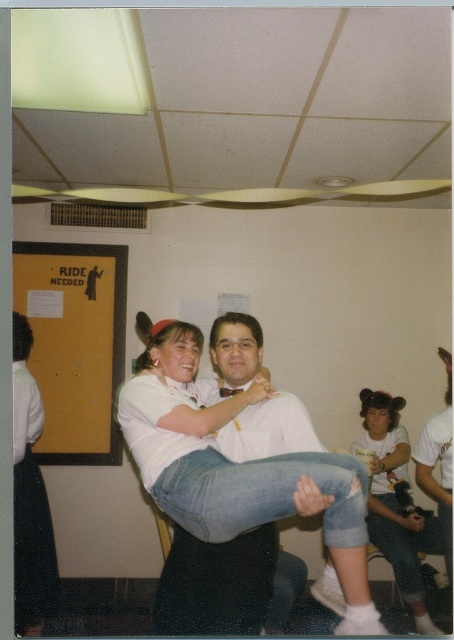
Question: From the image, what is the correct spatial relationship of white matte shirt at upper right in relation to matte black arm at lower center?

Choices:
 (A) left
 (B) right

Answer: (B)

Question: Estimate the real-world distances between objects in this image. Which object is closer to the matte white arm at lower right?

Choices:
 (A) denim shorts at lower right
 (B) white matte shirt at upper right
 (C) white matte t-shirt at center
 (D) matte black arm at lower center

Answer: (A)

Question: Does white matte arm at center appear over matte black arm at lower center?

Choices:
 (A) no
 (B) yes

Answer: (B)

Question: Is white matte shirt at upper right further to camera compared to matte white arm at lower right?

Choices:
 (A) yes
 (B) no

Answer: (B)

Question: Based on their relative distances, which object is nearer to the matte black arm at lower center?

Choices:
 (A) denim shorts at lower right
 (B) white matte t-shirt at center
 (C) matte white arm at lower right
 (D) white matte shirt at upper right

Answer: (A)

Question: Which point is farther to the camera?

Choices:
 (A) (374, 509)
 (B) (439, 413)
 (C) (384, 476)

Answer: (C)